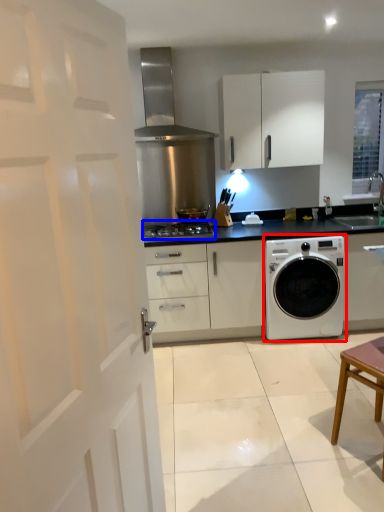
Question: Which of the following is the farthest to the observer, washing machine (highlighted by a red box) or gas stove (highlighted by a blue box)?

Choices:
 (A) washing machine
 (B) gas stove

Answer: (B)